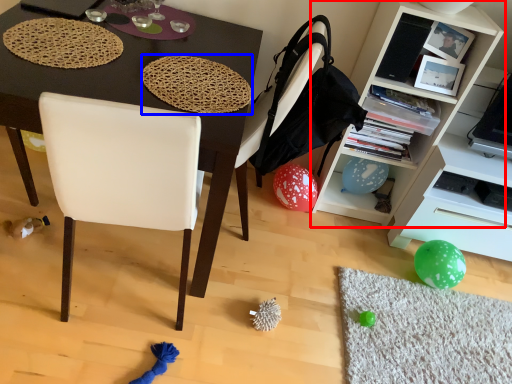
Question: Which point is further to the camera, cabinetry (highlighted by a red box) or mat (highlighted by a blue box)?

Choices:
 (A) cabinetry
 (B) mat

Answer: (A)